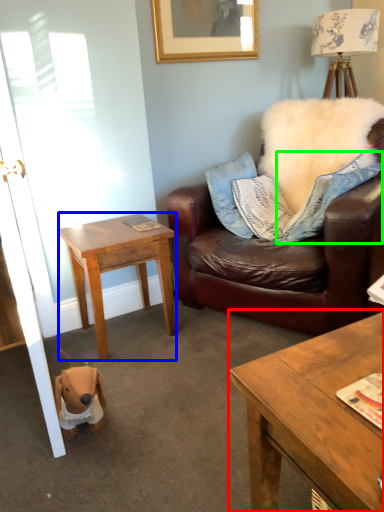
Question: Which object is the farthest from coffee table (highlighted by a red box)? Choose among these: desk (highlighted by a blue box) or pillow (highlighted by a green box).

Choices:
 (A) desk
 (B) pillow

Answer: (A)